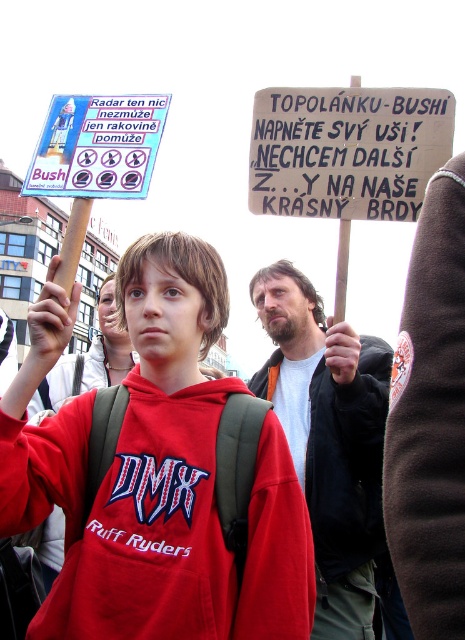
You are a photographer standing at the camera position. You want to take a closeup of the beige fabric jacket at center. Given that your camera has a maximum zoom range of 50 meters, can you capture the jacket clearly?

The beige fabric jacket at center is 43.77 meters from camera. Since the camera can zoom up to 50 meters, the jacket is within the maximum zoom range. Therefore, the photographer can capture the beige fabric jacket at center clearly.

You are a photographer trying to capture a clear shot of both the beige fabric jacket at center and the matte black jacket at center. Given their sizes, which jacket should you focus on first to ensure it fits within your camera frame?

The beige fabric jacket at center is larger in size than the matte black jacket at center, so you should focus on capturing the beige fabric jacket at center first to ensure it fits within the camera frame before adjusting for the smaller matte black jacket at center.

In the protest scene, there are two points marked as point 1 at coordinates (x=163, y=387) and point 2 at (x=272, y=148). Based on their positions, which point is closer to the camera?

Point 1 at coordinates (x=163, y=387) is closer to the camera because it is in front of point 2 at (x=272, y=148).